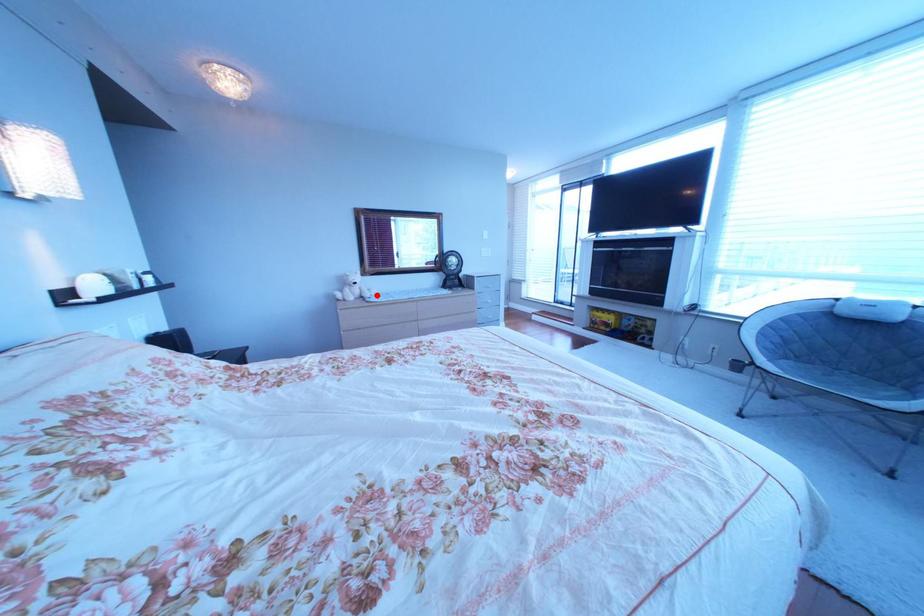
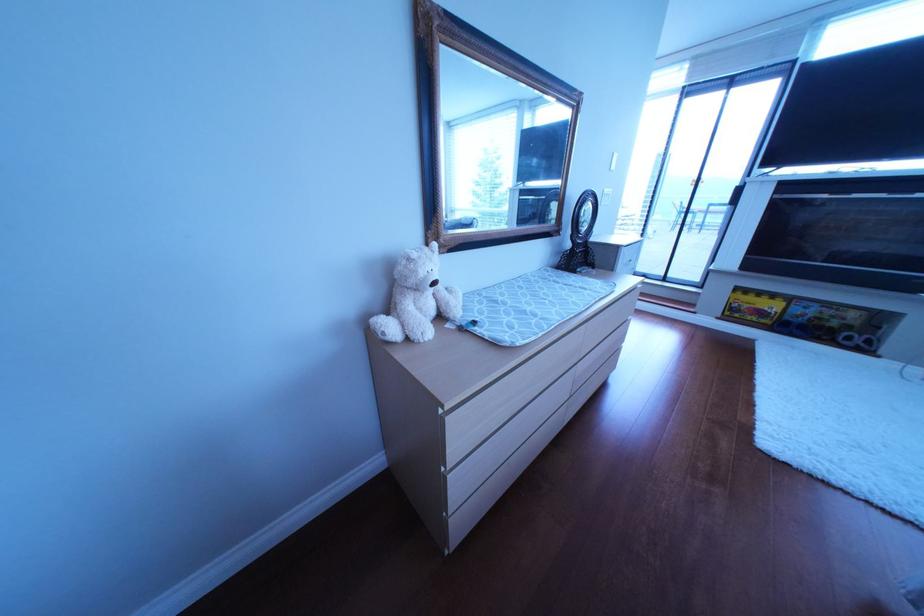
In the second image, find the point that corresponds to the highlighted location in the first image.

(458, 310)